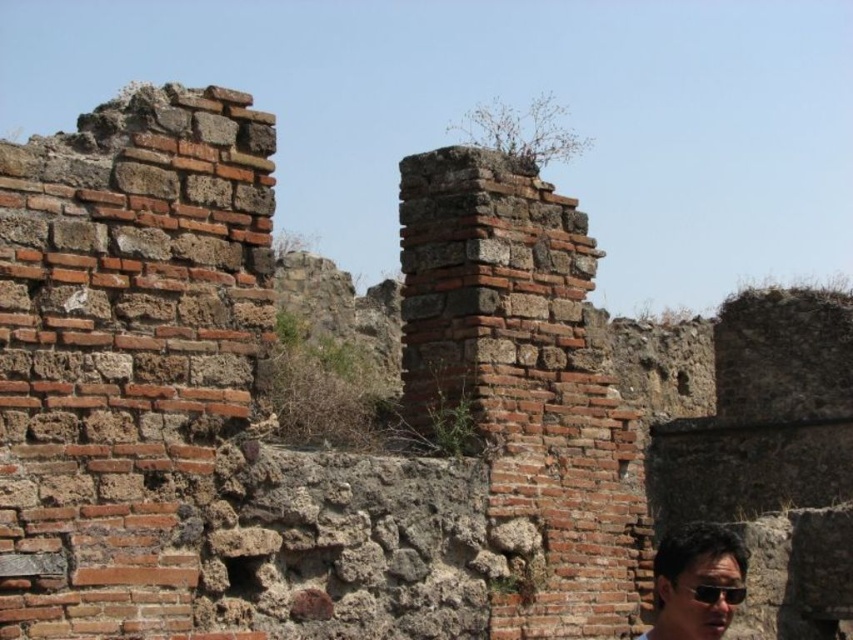
You are an archaeologist working at the ancient ruins site depicted in the image. You need to retrieve both the matte black sunglasses at lower right and the black plastic goggles at lower right. If you can only carry one item at a time, which item should you pick up first to minimize the distance walked? Explain your reasoning based on their positions.

You should pick up the matte black sunglasses at lower right first because they are closer to your starting position than the black plastic goggles at lower right. Since they are 9.03 feet apart, retrieving the closer item first reduces the total distance walked.

You are a tourist visiting the ancient ruins. You want to take a photo of the ruins with the matte black sunglasses at lower right in the foreground. Where should you position yourself to include both the ruins and the sunglasses in the frame?

Position yourself at the lower right area near the matte black sunglasses at lower right to include both the ruins in the background and the sunglasses in the foreground in your photo.